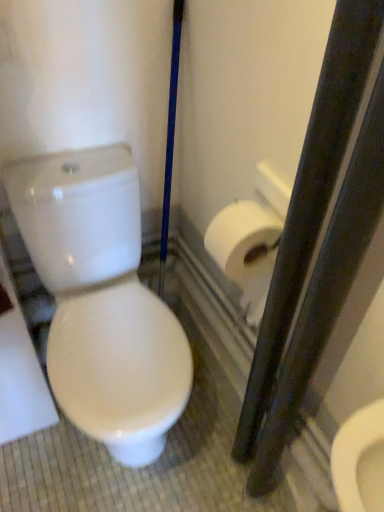
Question: Should I look upward or downward to see white matte toilet paper at right?

Choices:
 (A) down
 (B) up

Answer: (A)

Question: From a real-world perspective, is white glossy toilet at left located higher than white matte toilet paper at right?

Choices:
 (A) yes
 (B) no

Answer: (B)

Question: Would you say white glossy toilet at left is a long distance from white matte toilet paper at right?

Choices:
 (A) yes
 (B) no

Answer: (B)

Question: Would you say white glossy toilet at left is outside white matte toilet paper at right?

Choices:
 (A) yes
 (B) no

Answer: (A)

Question: Considering the relative sizes of white glossy toilet at left and white matte toilet paper at right in the image provided, is white glossy toilet at left taller than white matte toilet paper at right?

Choices:
 (A) no
 (B) yes

Answer: (B)

Question: Does white glossy toilet at left have a lesser width compared to white matte toilet paper at right?

Choices:
 (A) no
 (B) yes

Answer: (A)

Question: Is white glossy toilet at left shorter than white matte toilet paper at right?

Choices:
 (A) no
 (B) yes

Answer: (A)

Question: Is the surface of white matte toilet paper at right in direct contact with white glossy toilet at left?

Choices:
 (A) no
 (B) yes

Answer: (A)

Question: Is white glossy toilet at left surrounded by white matte toilet paper at right?

Choices:
 (A) no
 (B) yes

Answer: (A)

Question: From the image's perspective, would you say white matte toilet paper at right is positioned over white glossy toilet at left?

Choices:
 (A) no
 (B) yes

Answer: (B)

Question: From a real-world perspective, is white matte toilet paper at right on top of white glossy toilet at left?

Choices:
 (A) no
 (B) yes

Answer: (B)

Question: Is white matte toilet paper at right at the right side of white glossy toilet at left?

Choices:
 (A) no
 (B) yes

Answer: (B)

Question: Does white matte toilet paper at right have a lesser width compared to white glossy toilet at left?

Choices:
 (A) no
 (B) yes

Answer: (B)

Question: Would you say white glossy toilet at left is inside or outside white matte toilet paper at right?

Choices:
 (A) outside
 (B) inside

Answer: (A)